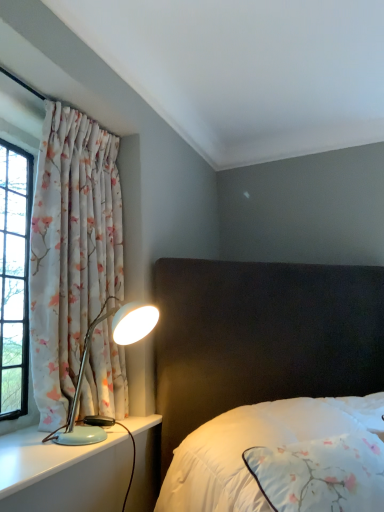
Where is `vacant area on top of floral fabric curtain at left (from a real-world perspective)`? This screenshot has height=512, width=384. vacant area on top of floral fabric curtain at left (from a real-world perspective) is located at coordinates (94, 118).